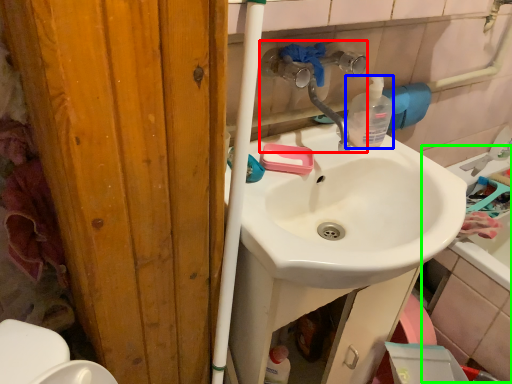
Question: Which object is positioned farthest from plumbing fixture (highlighted by a red box)? Select from bottle (highlighted by a blue box) and bath (highlighted by a green box).

Choices:
 (A) bottle
 (B) bath

Answer: (B)